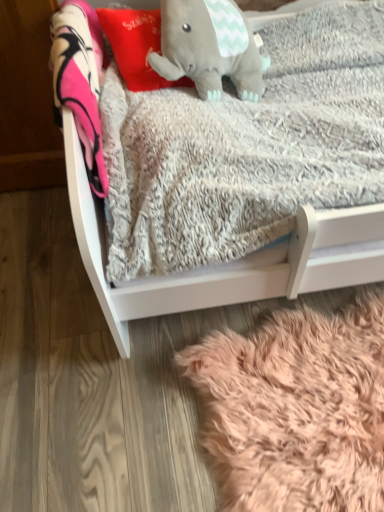
Question: Is the depth of red plush pillow at upper center greater than that of white soft wood infant bed at center?

Choices:
 (A) no
 (B) yes

Answer: (B)

Question: Is red plush pillow at upper center bigger than white soft wood infant bed at center?

Choices:
 (A) no
 (B) yes

Answer: (A)

Question: Does red plush pillow at upper center have a greater width compared to white soft wood infant bed at center?

Choices:
 (A) no
 (B) yes

Answer: (A)

Question: From the image's perspective, is red plush pillow at upper center located beneath white soft wood infant bed at center?

Choices:
 (A) yes
 (B) no

Answer: (B)

Question: Is red plush pillow at upper center outside white soft wood infant bed at center?

Choices:
 (A) no
 (B) yes

Answer: (A)

Question: Considering the relative sizes of red plush pillow at upper center and white soft wood infant bed at center in the image provided, is red plush pillow at upper center thinner than white soft wood infant bed at center?

Choices:
 (A) no
 (B) yes

Answer: (B)

Question: Can you confirm if white soft wood infant bed at center is positioned to the right of gray plush elephant at upper center?

Choices:
 (A) yes
 (B) no

Answer: (A)

Question: Is white soft wood infant bed at center further to camera compared to gray plush elephant at upper center?

Choices:
 (A) yes
 (B) no

Answer: (B)

Question: Is white soft wood infant bed at center wider than gray plush elephant at upper center?

Choices:
 (A) yes
 (B) no

Answer: (A)

Question: Is white soft wood infant bed at center taller than gray plush elephant at upper center?

Choices:
 (A) yes
 (B) no

Answer: (A)

Question: Is gray plush elephant at upper center inside white soft wood infant bed at center?

Choices:
 (A) no
 (B) yes

Answer: (B)

Question: Would you say white soft wood infant bed at center is a long distance from gray plush elephant at upper center?

Choices:
 (A) yes
 (B) no

Answer: (B)

Question: Is there a large distance between fuzzy pink rug at lower right and red plush pillow at upper center?

Choices:
 (A) yes
 (B) no

Answer: (B)